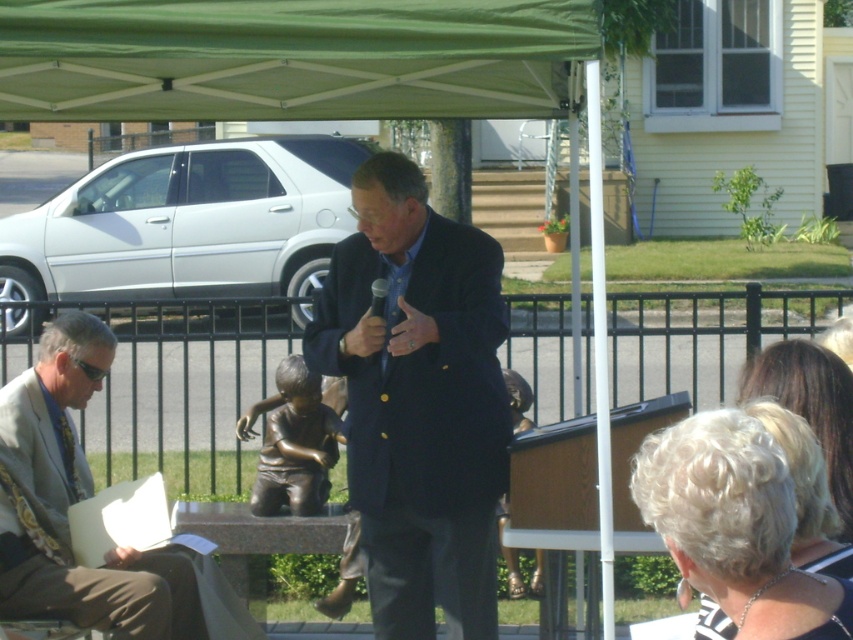
You are standing at the edge of the event area and want to approach the dark blue suit at center to ask a question. What is the approximate distance you need to cover to reach them?

The dark blue suit at center is approximately 6.36 meters away from the viewer, so you need to cover about 6.36 meters to reach them.

You are attending a lecture and want to move from your seat to the podium. There are two people in front of you, a dark blue suit at center and a gray suit at left. Which person do you need to ask to move first?

The dark blue suit at center is in front of gray suit at left, so you need to ask the dark blue suit at center to move first to reach the podium.